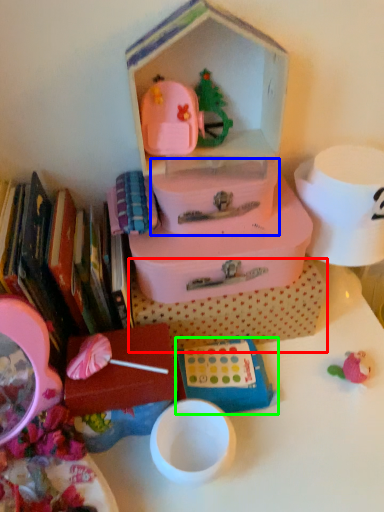
Question: Estimate the real-world distances between objects in this image. Which object is farther from storage box (highlighted by a red box), storage box (highlighted by a blue box) or toy (highlighted by a green box)?

Choices:
 (A) storage box
 (B) toy

Answer: (A)